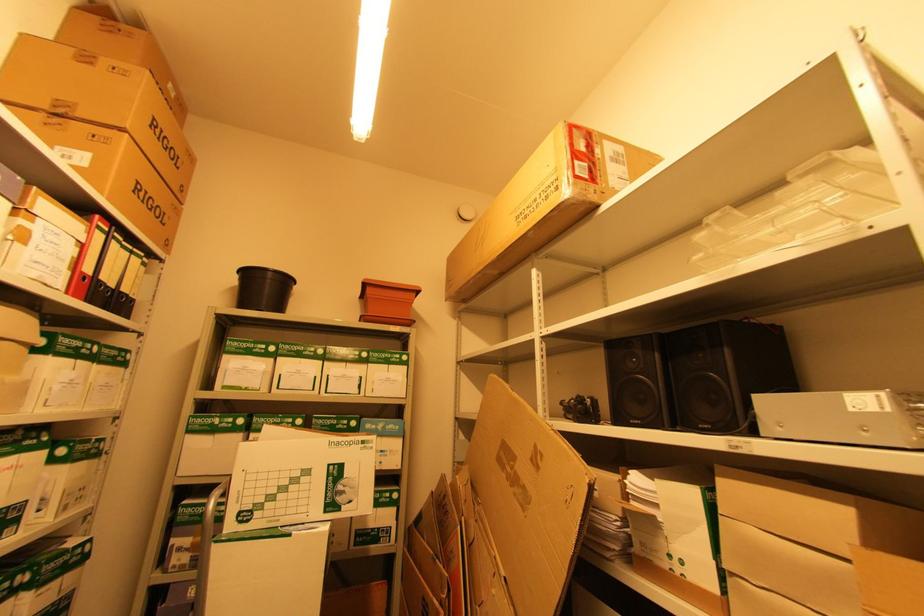
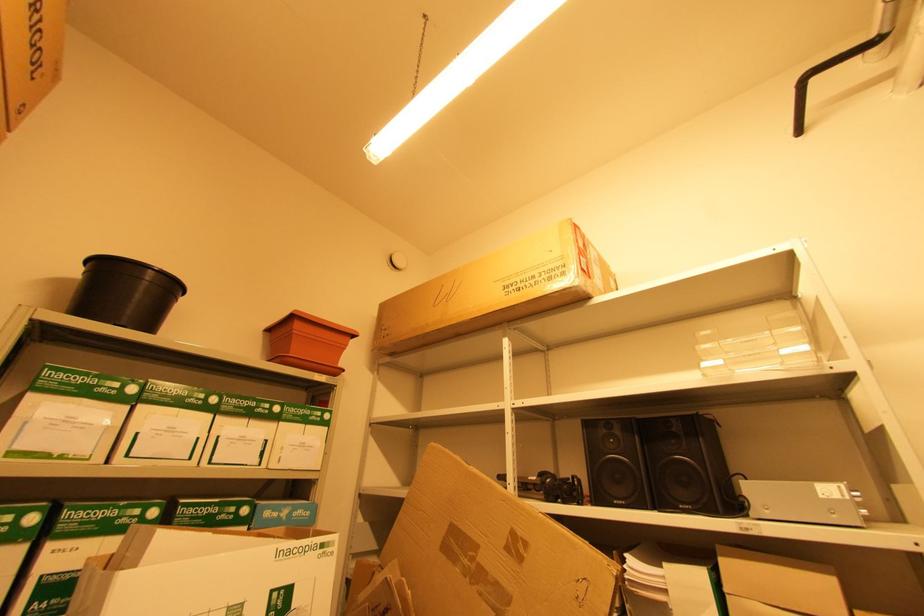
In a continuous first-person perspective shot, in which direction is the camera moving?

The movement direction of the cameraman is left, forward.